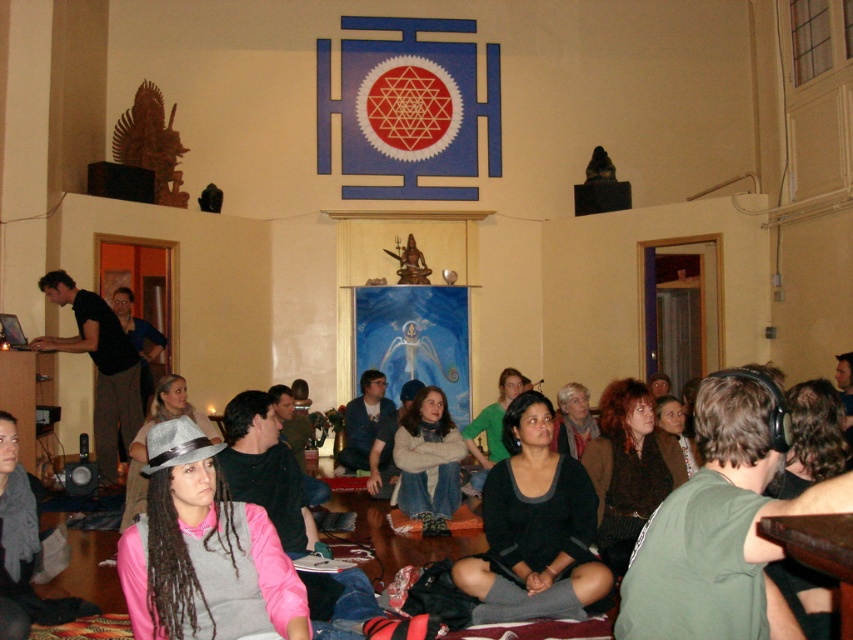
What do you see at coordinates (534, 529) in the screenshot? I see `black matte sweater at center` at bounding box center [534, 529].

Between point (456, 579) and point (96, 433), which one is positioned in front?

Positioned in front is point (456, 579).

Who is more distant from viewer, (524, 396) or (83, 346)?

Point (83, 346)

Where is `black matte sweater at center`? This screenshot has height=640, width=853. black matte sweater at center is located at coordinates (534, 529).